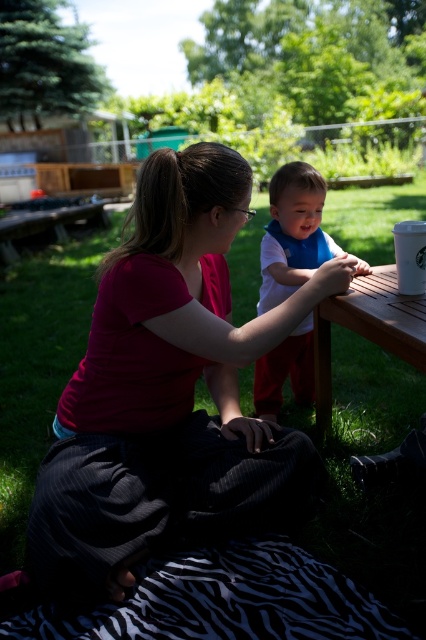
Can you confirm if matte red shirt at center is positioned to the left of white matte bib at center?

Correct, you'll find matte red shirt at center to the left of white matte bib at center.

Can you confirm if matte red shirt at center is smaller than white matte bib at center?

No, matte red shirt at center is not smaller than white matte bib at center.

Does point (247, 516) lie in front of point (321, 188)?

Yes, point (247, 516) is closer to viewer.

This screenshot has width=426, height=640. Find the location of `matte red shirt at center`. matte red shirt at center is located at coordinates (169, 392).

Does zebra-patterned fabric at lower center have a greater height compared to white matte bib at center?

No.

Can you confirm if zebra-patterned fabric at lower center is bigger than white matte bib at center?

Incorrect, zebra-patterned fabric at lower center is not larger than white matte bib at center.

At what (x,y) coordinates should I click in order to perform the action: click on zebra-patterned fabric at lower center. Please return your answer as a coordinate pair (x, y). Looking at the image, I should click on (227, 602).

Can you confirm if matte red shirt at center is shorter than wooden table at center?

No.

Is point (71, 497) more distant than point (362, 304)?

No, (71, 497) is in front of (362, 304).

Identify the location of matte red shirt at center. (169, 392).